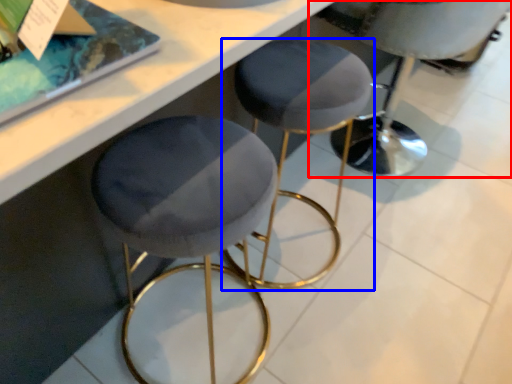
Question: Which object is further to the camera taking this photo, swivel chair (highlighted by a red box) or stool (highlighted by a blue box)?

Choices:
 (A) swivel chair
 (B) stool

Answer: (A)